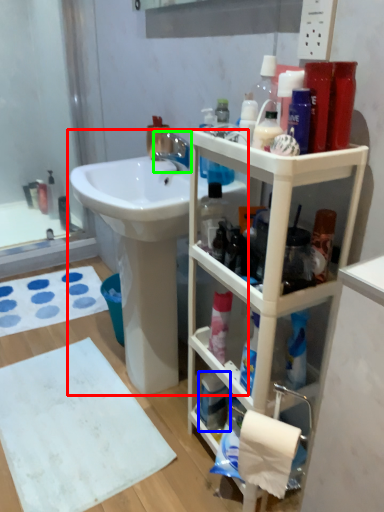
Question: Based on their relative distances, which object is nearer to sink (highlighted by a red box)? Choose from mouthwash (highlighted by a blue box) and tap (highlighted by a green box).

Choices:
 (A) mouthwash
 (B) tap

Answer: (B)